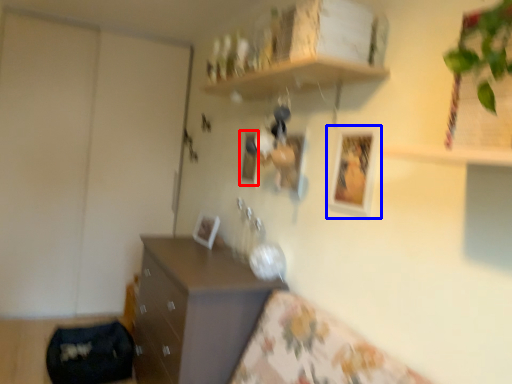
Question: Which point is further to the camera, picture frame (highlighted by a red box) or picture frame (highlighted by a blue box)?

Choices:
 (A) picture frame
 (B) picture frame

Answer: (A)